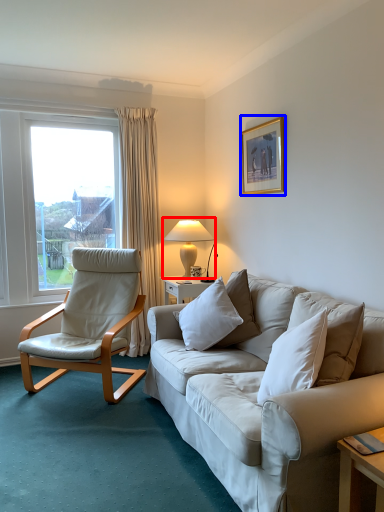
Question: Which object appears farthest to the camera in this image, table lamp (highlighted by a red box) or picture frame (highlighted by a blue box)?

Choices:
 (A) table lamp
 (B) picture frame

Answer: (A)